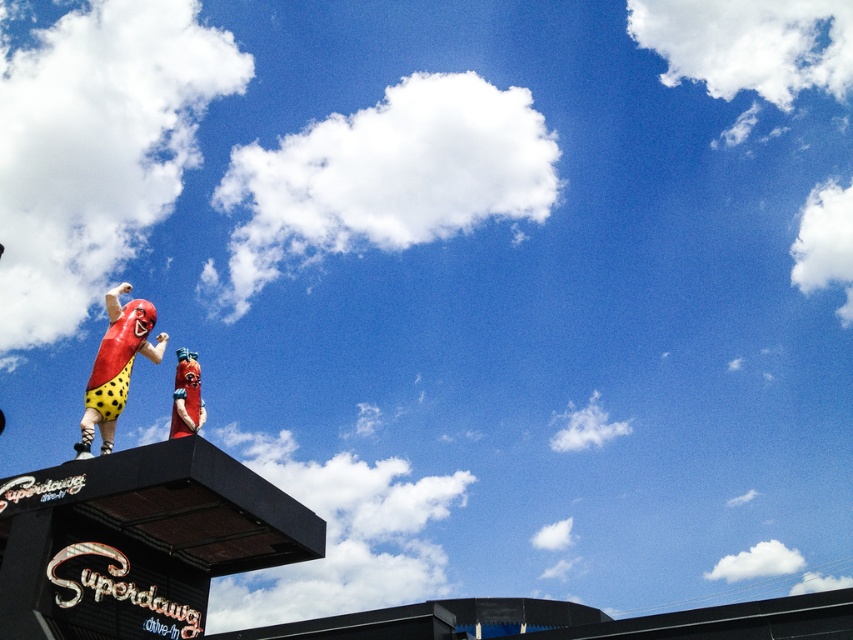
What is the relationship between the widths of the glossy plastic hot dog at upper left and the matte red statue at upper center?

The glossy plastic hot dog at upper left is wider than the matte red statue at upper center according to the description.

You are a customer at the Superdawg Drive In and want to take a photo with the two statues. The glossy plastic hot dog at upper left and the matte red statue at upper center. To ensure both are in the frame, where should you position yourself relative to the statues?

You should position yourself below both the glossy plastic hot dog at upper left and the matte red statue at upper center so that both are visible in the frame since the glossy plastic hot dog at upper left is located below the matte red statue at upper center.

You are standing in front of the Superdawg Drive In sign. There are two points marked on the sign. The first point is at coordinates point (148,356) and the second point is at point (189,410). Which point is closer to you?

Point (148,356) is closer to you because it is further to the viewer than point (189,410).